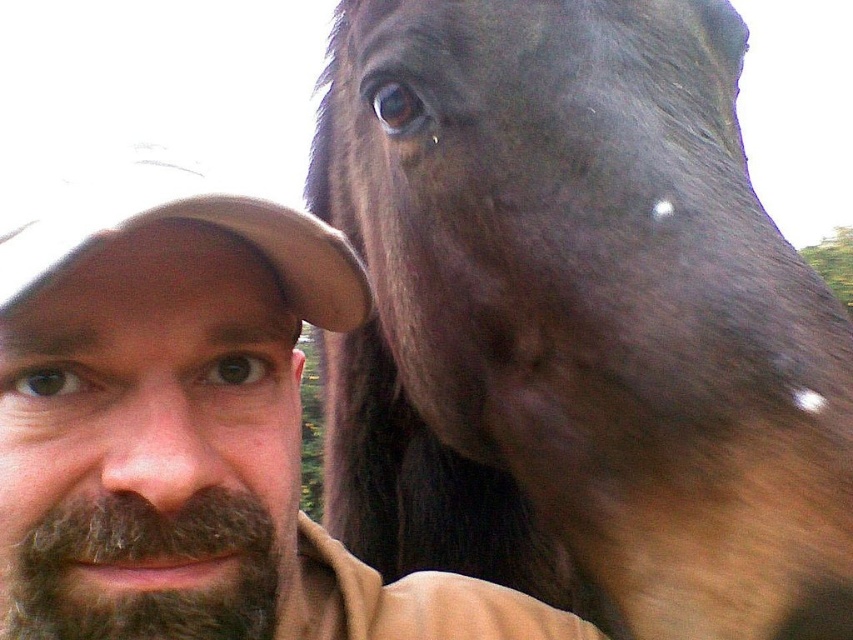
You are holding a 60 cm long stick and want to touch the point at coordinates point (189, 509) in the image. Can you reach it with your stick?

The point point (189, 509) is 62.05 centimeters from the viewer. Since the stick is 60 cm long, you cannot reach it because the distance is slightly longer than the stick.

You are taking a selfie and notice two items on your left side in the frame. You need to decide which one is closer to the camera. The items are the brown beard at left and the tan fabric baseball cap at left. Which one is closer?

The brown beard at left is taller than the tan fabric baseball cap at left, so the brown beard at left is closer to the camera.